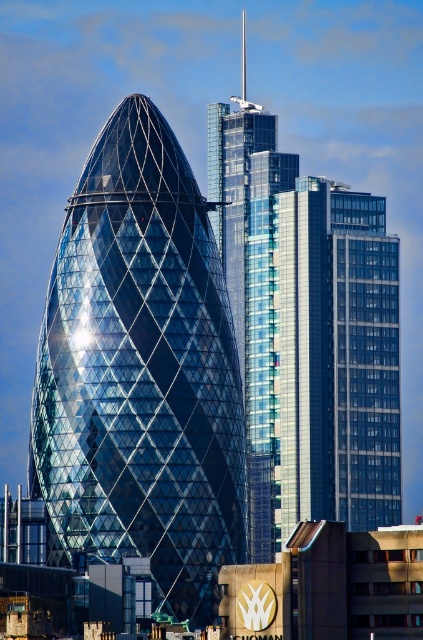
You are a tourist standing in front of the Gherkin and another skyscraper. You notice two buildings in front of you labeled as the shiny glass tower at center and the glassy steel building at center. Which building is positioned to the left?

The shiny glass tower at center is to the left of the glassy steel building at center, so the shiny glass tower at center is positioned to the left.